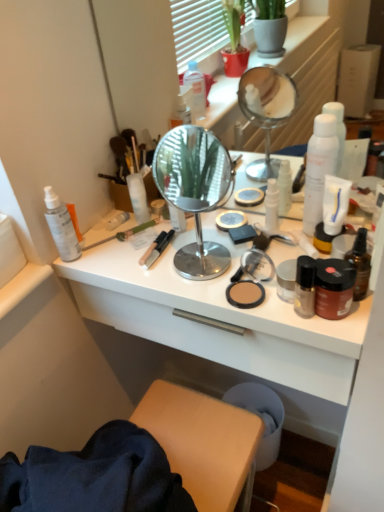
At what (x,y) coordinates should I click in order to perform the action: click on vacant space in front of white matte bottle at center, the 5th toiletry viewed from the right. Please return your answer as a coordinate pair (x, y). Looking at the image, I should click on (151, 256).